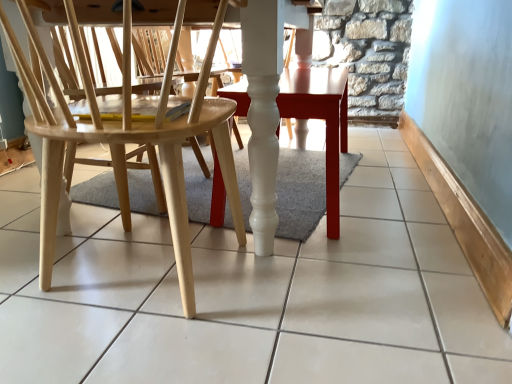
Find the location of a particular element. unoccupied space behind natural wood chair at left is located at coordinates (133, 211).